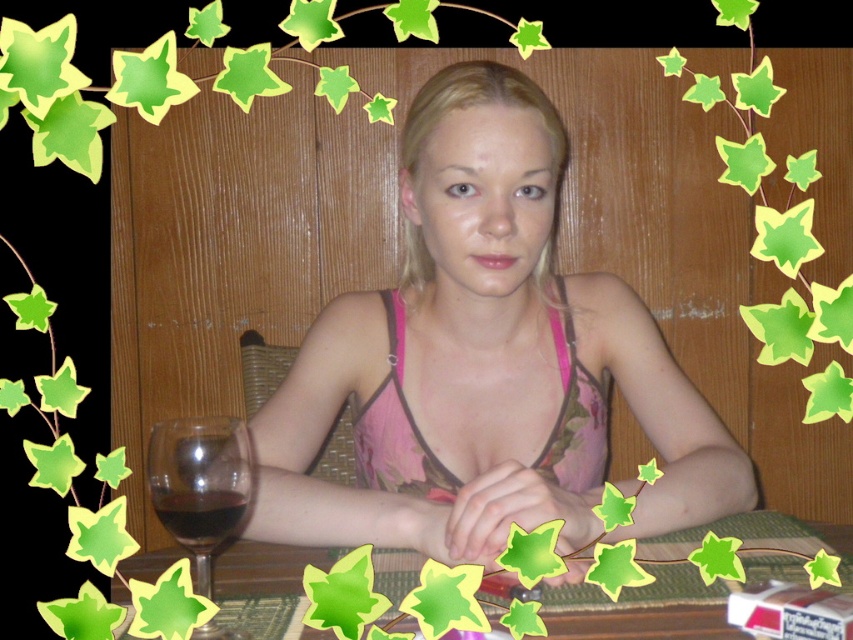
Question: Estimate the real-world distances between objects in this image. Which object is farther from the bamboo mat at center?

Choices:
 (A) pink floral bikini top at center
 (B) pink floral dress at center
 (C) dark red liquid at lower left
 (D) transparent glass at lower left

Answer: (C)

Question: Which of the following is the farthest from the observer?

Choices:
 (A) transparent glass at lower left
 (B) pink floral bikini top at center
 (C) pink floral dress at center

Answer: (B)

Question: Which of the following is the closest to the observer?

Choices:
 (A) (212, 515)
 (B) (225, 429)
 (C) (595, 428)
 (D) (444, 531)

Answer: (A)

Question: Observing the image, what is the correct spatial positioning of bamboo mat at center in reference to dark red liquid at lower left?

Choices:
 (A) right
 (B) left

Answer: (A)

Question: Is pink floral dress at center closer to the viewer compared to dark red liquid at lower left?

Choices:
 (A) no
 (B) yes

Answer: (A)

Question: Is pink floral dress at center closer to camera compared to bamboo mat at center?

Choices:
 (A) yes
 (B) no

Answer: (B)